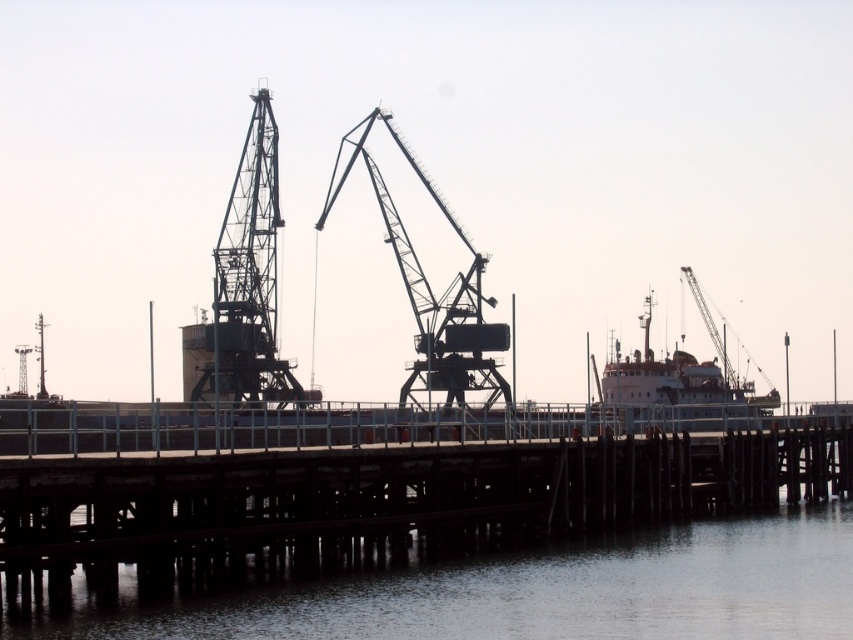
Does brown wooden dock at center have a smaller size compared to metallic gray crane at center-left?

No.

Is brown wooden dock at center to the left of metallic gray crane at center-left from the viewer's perspective?

Incorrect, brown wooden dock at center is not on the left side of metallic gray crane at center-left.

Identify the location of brown wooden dock at center. The width and height of the screenshot is (853, 640). 402,492.

Consider the image. Does metallic gray crane at center-left have a smaller size compared to white glossy ship at center?

Yes.

Who is more distant from viewer, (x=264, y=204) or (x=756, y=412)?

The point (x=264, y=204) is behind.

This screenshot has height=640, width=853. Describe the element at coordinates (244, 285) in the screenshot. I see `metallic gray crane at center-left` at that location.

At what (x,y) coordinates should I click in order to perform the action: click on metallic gray crane at center-left. Please return your answer as a coordinate pair (x, y). The image size is (853, 640). Looking at the image, I should click on (244, 285).

Between transparent water at lower center and metallic gray crane at center-left, which one is positioned lower?

transparent water at lower center

From the picture: Can you confirm if transparent water at lower center is taller than metallic gray crane at center-left?

No.

Identify the location of transparent water at lower center. The height and width of the screenshot is (640, 853). [x=532, y=593].

The height and width of the screenshot is (640, 853). Find the location of `transparent water at lower center`. transparent water at lower center is located at coordinates (532, 593).